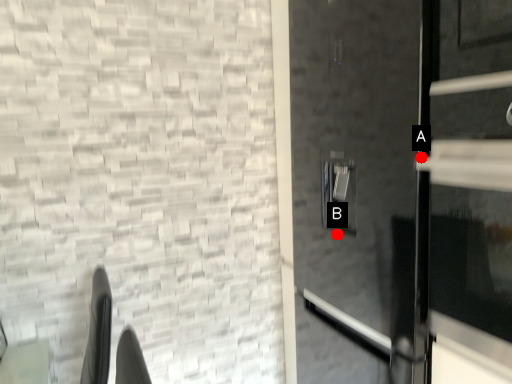
Question: Two points are circled on the image, labeled by A and B beside each circle. Among these points, which one is farthest from the camera?

Choices:
 (A) A is further
 (B) B is further

Answer: (B)